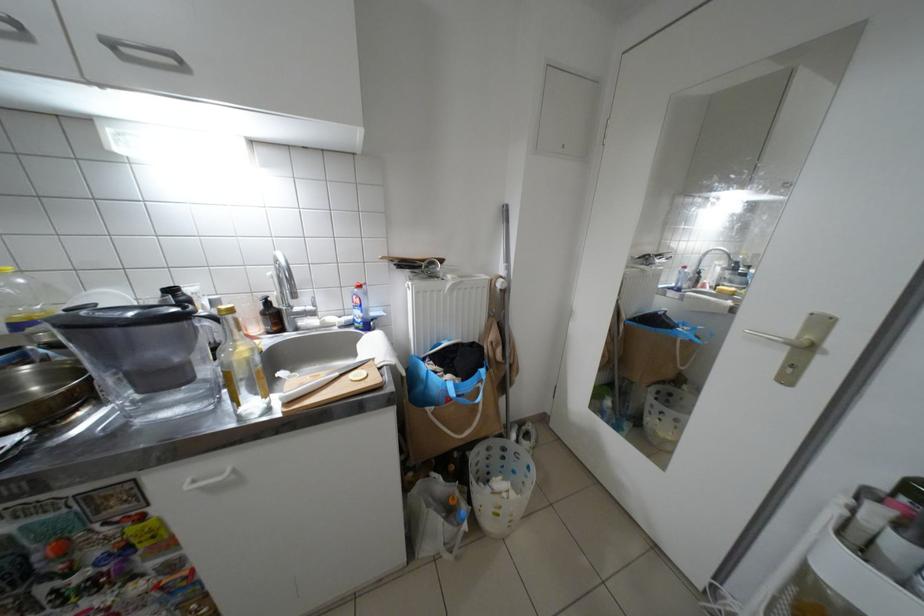
The height and width of the screenshot is (616, 924). What do you see at coordinates (451, 537) in the screenshot?
I see `the white basket handle` at bounding box center [451, 537].